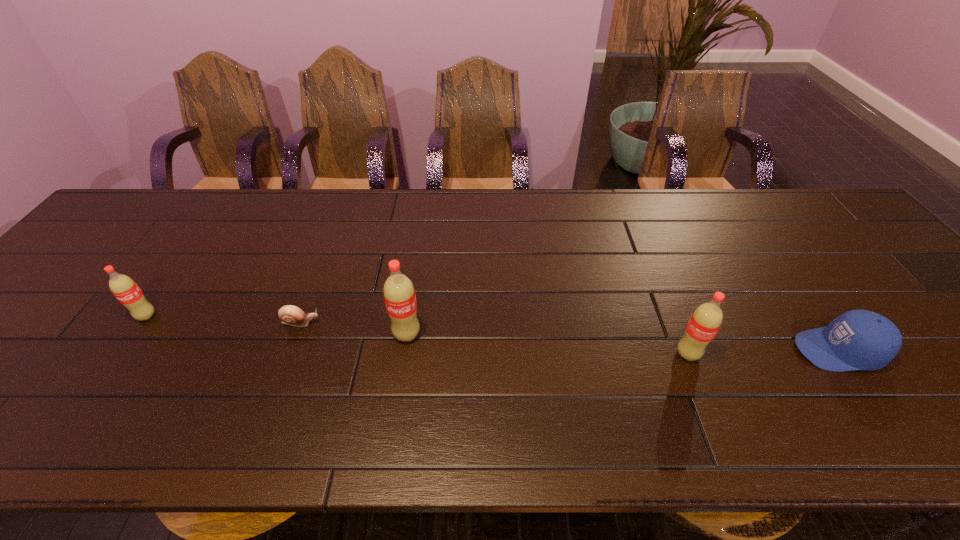
This screenshot has height=540, width=960. I want to click on free space between the shortest soda and the shortest object, so click(224, 319).

At what (x,y) coordinates should I click in order to perform the action: click on unoccupied position between the cap and the second tallest soda. Please return your answer as a coordinate pair (x, y). The image size is (960, 540). Looking at the image, I should click on (762, 352).

I want to click on object that is the fourth closest one to the escargot, so click(858, 339).

Where is `object that is the fourth closest one to the rightmost soda`? This screenshot has height=540, width=960. object that is the fourth closest one to the rightmost soda is located at coordinates (124, 288).

Where is `soda that stands as the second closest to the fourth shortest object`? The width and height of the screenshot is (960, 540). soda that stands as the second closest to the fourth shortest object is located at coordinates (124, 288).

The height and width of the screenshot is (540, 960). Identify the location of soda that stands as the second closest to the third tallest object. (705, 321).

Locate an element on the screen. The width and height of the screenshot is (960, 540). free space that satisfies the following two spatial constraints: 1. on the front-facing side of the escargot; 2. on the right side of the second soda from right to left is located at coordinates (297, 334).

Find the location of a particular element. The height and width of the screenshot is (540, 960). free space in the image that satisfies the following two spatial constraints: 1. on the front-facing side of the second object from left to right; 2. on the back side of the second object from right to left is located at coordinates (289, 354).

At what (x,y) coordinates should I click in order to perform the action: click on free region that satisfies the following two spatial constraints: 1. on the front-facing side of the third object from left to right; 2. on the left side of the escargot. Please return your answer as a coordinate pair (x, y). Looking at the image, I should click on (297, 334).

Where is `vacant space that satisfies the following two spatial constraints: 1. on the front-facing side of the shortest object; 2. on the left side of the second soda from right to left`? This screenshot has width=960, height=540. vacant space that satisfies the following two spatial constraints: 1. on the front-facing side of the shortest object; 2. on the left side of the second soda from right to left is located at coordinates (297, 334).